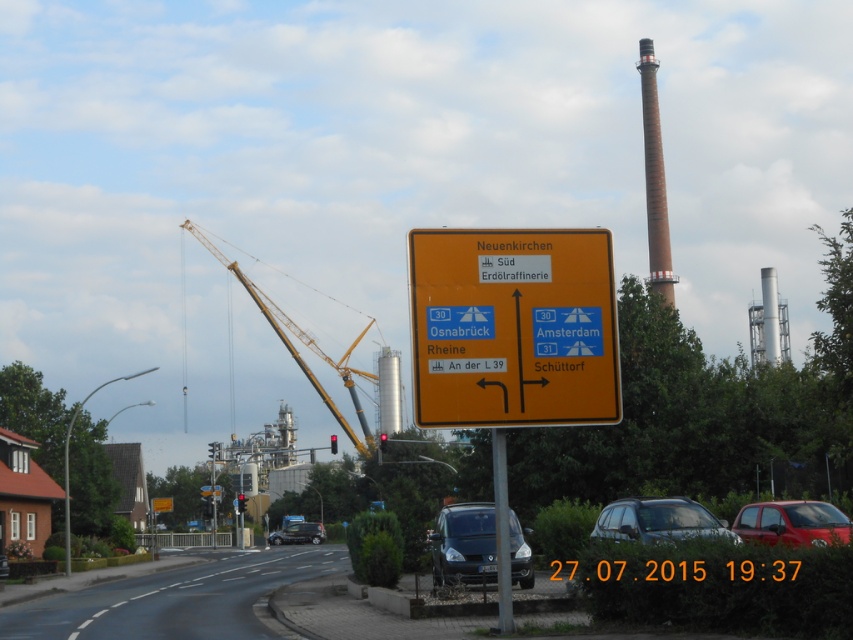
Does yellow plastic sign at center have a lesser width compared to satin silver car at center?

In fact, yellow plastic sign at center might be wider than satin silver car at center.

Looking at this image, who is more distant from viewer, (584, 416) or (631, 499)?

Positioned behind is point (631, 499).

Image resolution: width=853 pixels, height=640 pixels. In order to click on yellow plastic sign at center in this screenshot , I will do `click(514, 326)`.

Is satin silver car at center to the left of metallic pole at center from the viewer's perspective?

Incorrect, satin silver car at center is not on the left side of metallic pole at center.

The height and width of the screenshot is (640, 853). Find the location of `satin silver car at center`. satin silver car at center is located at coordinates (659, 520).

Does satin silver car at center lie in front of yellow metallic crane at left?

Yes, satin silver car at center is in front of yellow metallic crane at left.

Is point (697, 516) positioned before point (367, 374)?

Yes, point (697, 516) is closer to viewer.

Is point (625, 536) positioned after point (296, 355)?

No, it is not.

Find the location of a particular element. This screenshot has width=853, height=640. satin silver car at center is located at coordinates (659, 520).